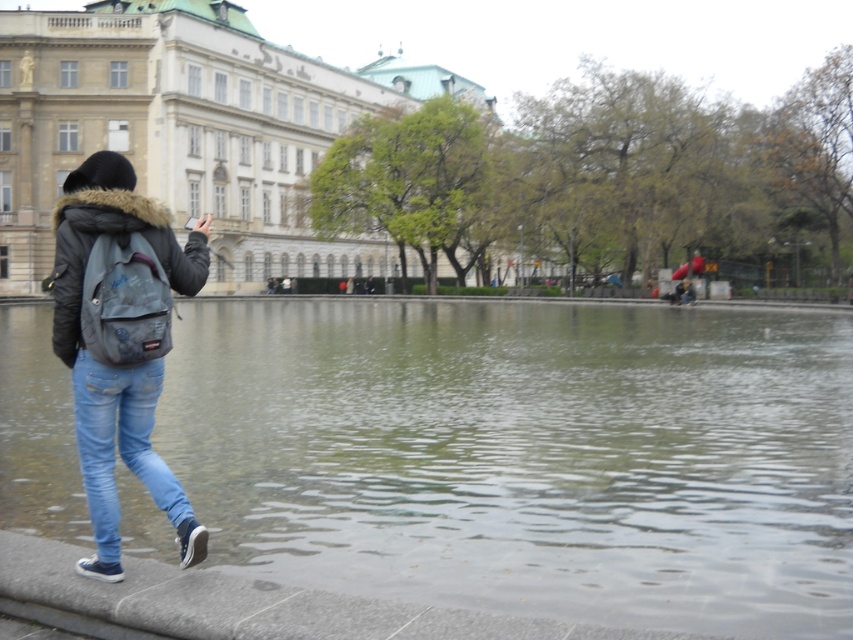
Question: In this image, where is white stone palace at upper center located relative to light blue denim jeans at lower left?

Choices:
 (A) left
 (B) right

Answer: (A)

Question: Is light blue denim jeans at lower left closer to the viewer compared to denim backpack at left?

Choices:
 (A) yes
 (B) no

Answer: (A)

Question: Which point is closer to the camera?

Choices:
 (A) denim backpack at left
 (B) white stone palace at upper center
 (C) denim jacket at left
 (D) clear water at center

Answer: (C)

Question: Based on their relative distances, which object is farther from the light blue denim jeans at lower left?

Choices:
 (A) white stone palace at upper center
 (B) denim backpack at left

Answer: (A)

Question: Which object appears farthest from the camera in this image?

Choices:
 (A) denim jacket at left
 (B) light blue denim jeans at lower left
 (C) white stone palace at upper center
 (D) clear water at center

Answer: (C)

Question: Is white stone palace at upper center positioned before denim backpack at left?

Choices:
 (A) yes
 (B) no

Answer: (B)